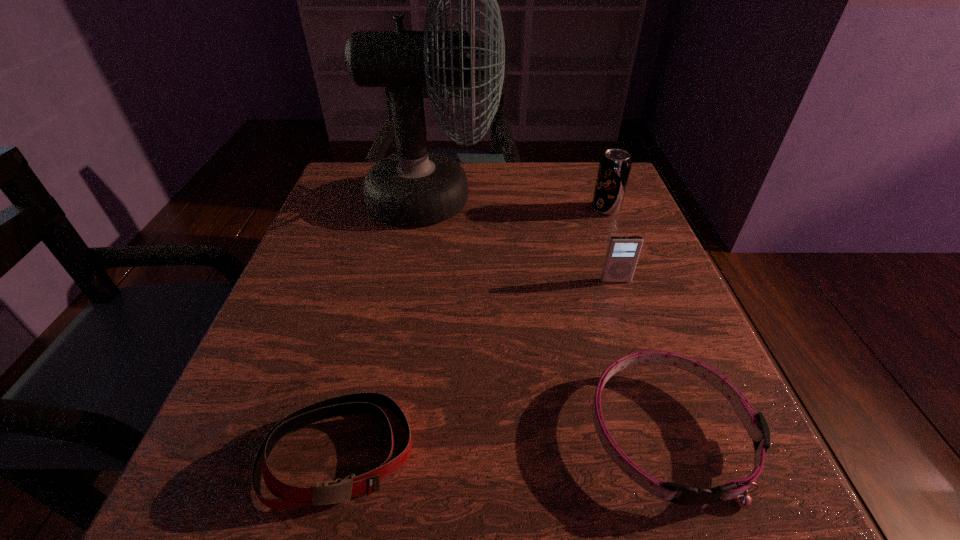
Locate an element on the screen. the tallest object is located at coordinates (414, 187).

Where is `the second tallest object`? the second tallest object is located at coordinates (614, 168).

In order to click on the third farthest object in this screenshot , I will do `click(622, 253)`.

This screenshot has height=540, width=960. Identify the location of the third tallest object. (622, 253).

This screenshot has height=540, width=960. What are the coordinates of `the left dog collar` in the screenshot? It's located at (289, 496).

Locate an element on the screen. the right dog collar is located at coordinates tap(756, 425).

The width and height of the screenshot is (960, 540). Identify the location of vacant space located in front of the tallest object where the airflow is directed. (534, 200).

In order to click on free space located 0.110m on the back of the second tallest object in this screenshot , I will do `click(594, 178)`.

This screenshot has height=540, width=960. Identify the location of vacant space located 0.260m on the front-facing side of the third nearest object. (658, 404).

Locate an element on the screen. The image size is (960, 540). free space located on the right of the left dog collar is located at coordinates (495, 454).